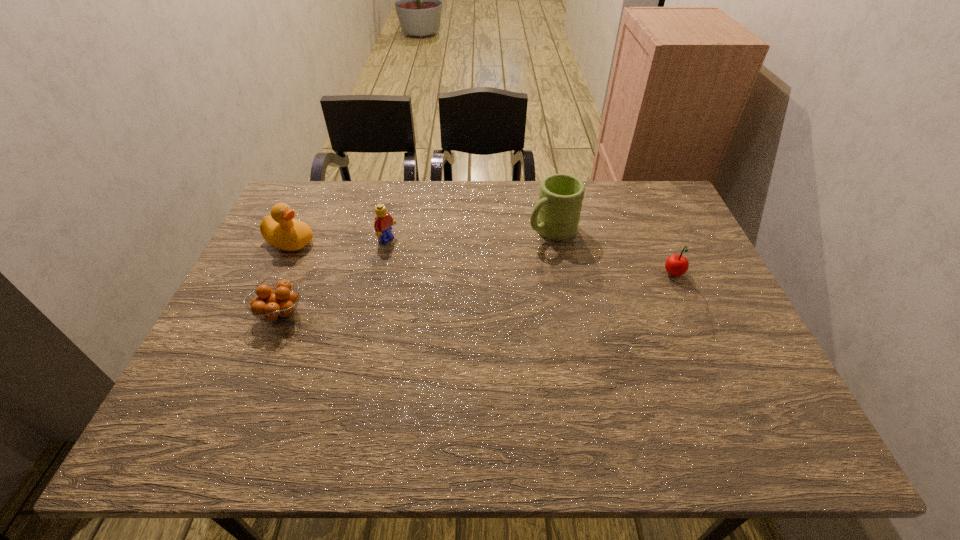
Find the location of a particular element. The width and height of the screenshot is (960, 540). vacant spot on the desktop that is between the shortest object and the rightmost object and is positioned on the front-facing side of the Lego is located at coordinates (495, 293).

I want to click on free space on the desktop that is between the orange fruit and the second nearest object and is positioned on the face of the duck, so click(x=446, y=298).

This screenshot has height=540, width=960. In order to click on free spot on the desktop that is between the shortest object and the fourth farthest object and is positioned on the side of the second object from right to left with the handle in this screenshot , I will do `click(447, 298)`.